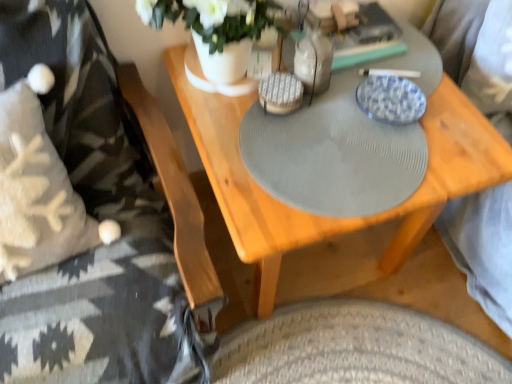
The height and width of the screenshot is (384, 512). In order to click on vacant region in front of blue glazed plate at upper center in this screenshot , I will do `click(398, 164)`.